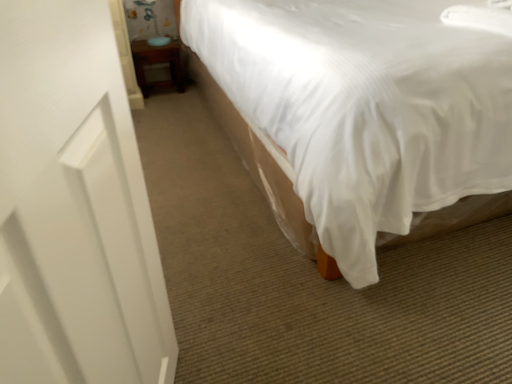
Question: Considering the relative sizes of white matte screen door at left and white fabric bed at center in the image provided, is white matte screen door at left wider than white fabric bed at center?

Choices:
 (A) no
 (B) yes

Answer: (A)

Question: Is white matte screen door at left shorter than white fabric bed at center?

Choices:
 (A) no
 (B) yes

Answer: (A)

Question: From a real-world perspective, is white matte screen door at left positioned under white fabric bed at center based on gravity?

Choices:
 (A) yes
 (B) no

Answer: (B)

Question: Is white matte screen door at left in contact with white fabric bed at center?

Choices:
 (A) yes
 (B) no

Answer: (B)

Question: Is white matte screen door at left outside white fabric bed at center?

Choices:
 (A) no
 (B) yes

Answer: (B)

Question: Is white matte screen door at left turned away from white fabric bed at center?

Choices:
 (A) yes
 (B) no

Answer: (B)

Question: Is the depth of white matte screen door at left greater than that of wooden table at lower left?

Choices:
 (A) yes
 (B) no

Answer: (B)

Question: From the image's perspective, would you say white matte screen door at left is positioned over wooden table at lower left?

Choices:
 (A) yes
 (B) no

Answer: (B)

Question: Is wooden table at lower left surrounded by white matte screen door at left?

Choices:
 (A) yes
 (B) no

Answer: (B)

Question: Is white matte screen door at left to the left of wooden table at lower left from the viewer's perspective?

Choices:
 (A) no
 (B) yes

Answer: (A)

Question: Considering the relative sizes of white matte screen door at left and wooden table at lower left in the image provided, is white matte screen door at left wider than wooden table at lower left?

Choices:
 (A) yes
 (B) no

Answer: (B)

Question: From a real-world perspective, is white matte screen door at left located beneath wooden table at lower left?

Choices:
 (A) yes
 (B) no

Answer: (B)

Question: Can you confirm if white fabric bed at center is thinner than wooden table at lower left?

Choices:
 (A) yes
 (B) no

Answer: (B)